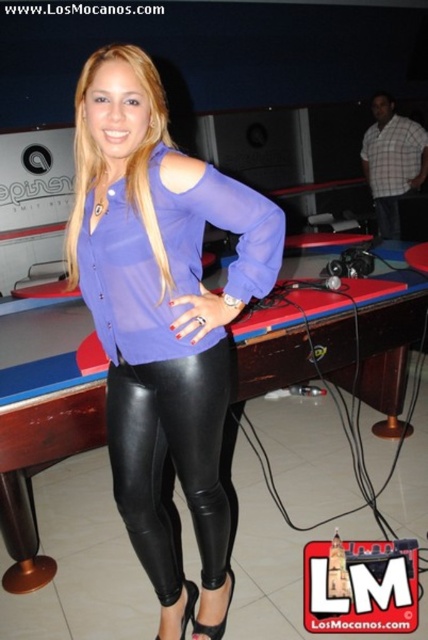
Can you confirm if matte purple blouse at center is shorter than black leather billiard table at center?

No, matte purple blouse at center is not shorter than black leather billiard table at center.

Measure the distance between matte purple blouse at center and black leather billiard table at center.

They are 73.07 centimeters apart.

Does point (219, 376) come closer to viewer compared to point (50, 413)?

That is True.

The width and height of the screenshot is (428, 640). What are the coordinates of `matte purple blouse at center` in the screenshot? It's located at (162, 317).

Who is taller, matte purple blouse at center or black leather leggings at center?

With more height is matte purple blouse at center.

Between point (216, 381) and point (208, 580), which one is positioned in front?

Point (216, 381) is more forward.

Is point (133, 493) more distant than point (130, 451)?

Yes, it is behind point (130, 451).

Where is `matte purple blouse at center`? matte purple blouse at center is located at coordinates (162, 317).

Who is taller, black leather billiard table at center or black leather leggings at center?

black leather leggings at center

Does black leather billiard table at center have a smaller size compared to black leather leggings at center?

Incorrect, black leather billiard table at center is not smaller in size than black leather leggings at center.

This screenshot has height=640, width=428. What do you see at coordinates (39, 468) in the screenshot? I see `black leather billiard table at center` at bounding box center [39, 468].

The image size is (428, 640). I want to click on black leather billiard table at center, so click(39, 468).